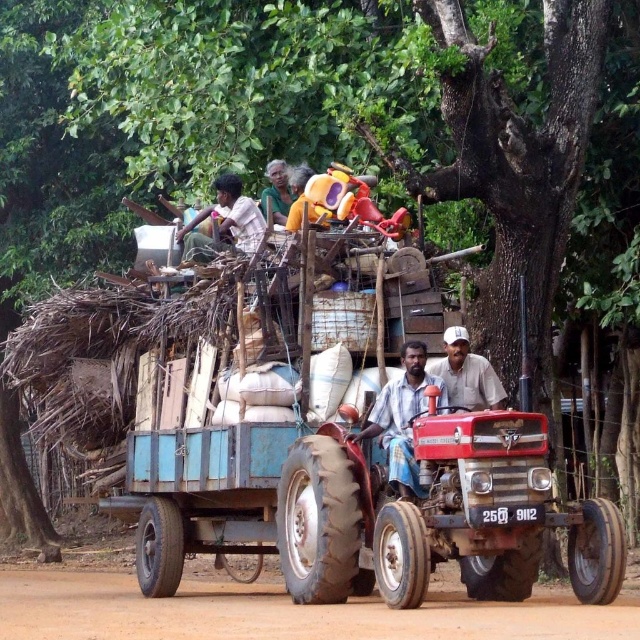
Looking at this image, you are a farmer standing at the edge of the field and want to cross to the other side. The brown dirt track at lower center and the light brown fabric shirt at upper center are in your path. Which one do you need to avoid stepping on to prevent slipping?

The brown dirt track at lower center is taller than the light brown fabric shirt at upper center, so you should avoid stepping on the brown dirt track at lower center as it is higher and might be slippery.

You are a farmer standing in the field and see the light brown fabric shirt at upper center and the light brown wooden stick at upper center. Which object is closer to you?

The light brown fabric shirt at upper center is closer to you because it is in front of the light brown wooden stick at upper center.

Based on the photo, you are a farmer standing in the middle of the field. You see a light brown fabric shirt at center and a white cotton shirt at center. Which shirt is taller?

The light brown fabric shirt at center is taller than the white cotton shirt at center.